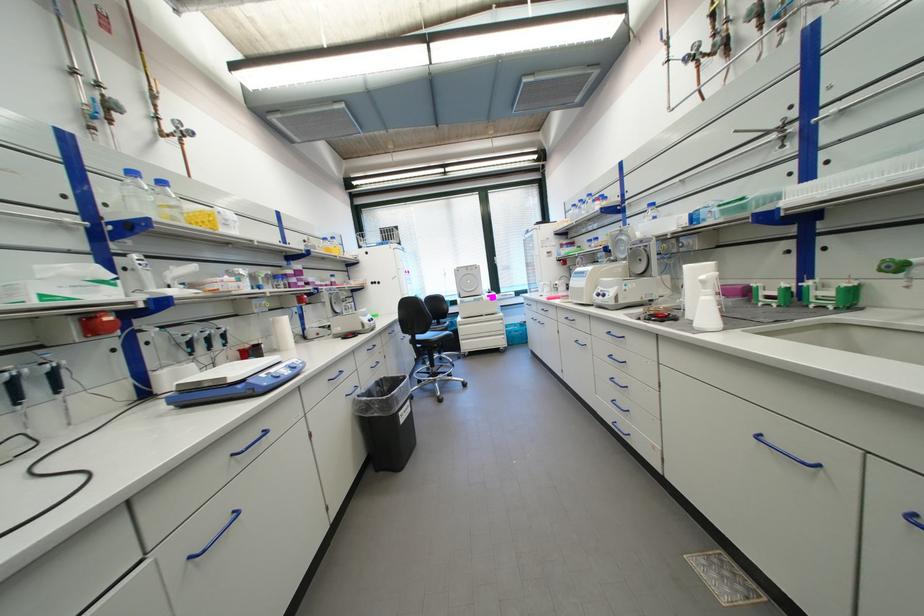
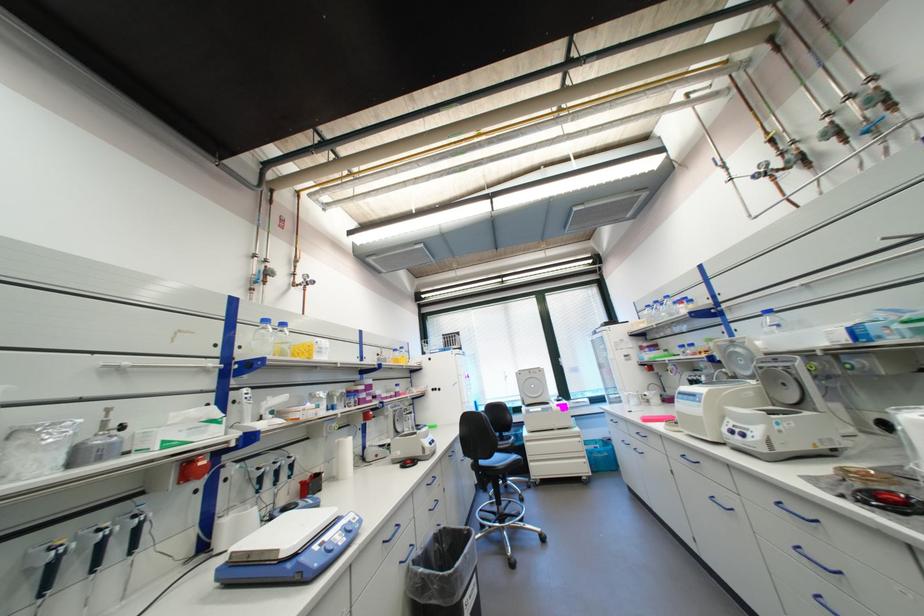
Where in the second image is the point corresponding to (660,206) from the first image?

(776, 312)